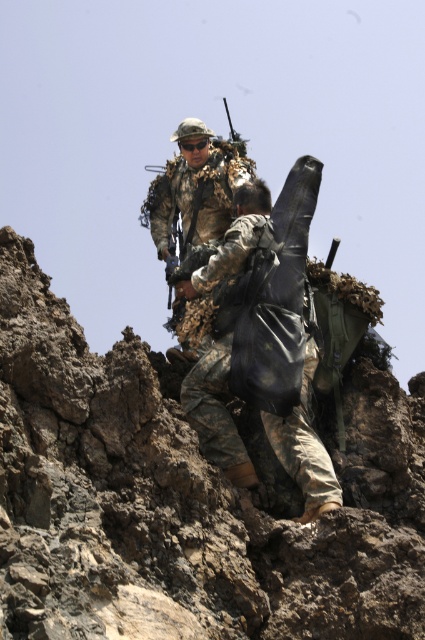
You are part of a military team navigating a rocky slope. You see the brown rugged rock at center and the camouflage fabric uniform at center. Which object is positioned higher on the slope?

The camouflage fabric uniform at center is positioned higher on the slope than the brown rugged rock at center according to the description.

Based on the photo, you are part of a military team navigating a rocky slope. You notice the brown rugged rock at center and the camouflage fabric backpack at center. Which object is shorter in height?

The brown rugged rock at center is not as tall as the camouflage fabric backpack at center, so the brown rugged rock at center is shorter in height.